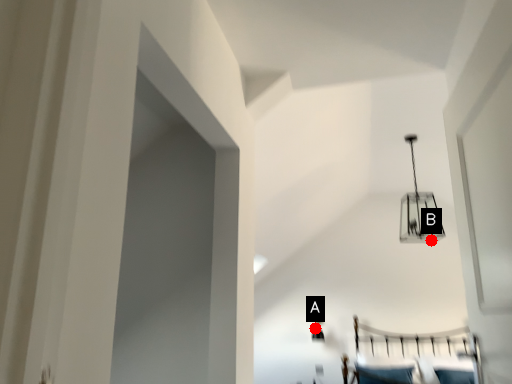
Question: Two points are circled on the image, labeled by A and B beside each circle. Which point is closer to the camera?

Choices:
 (A) A is closer
 (B) B is closer

Answer: (A)